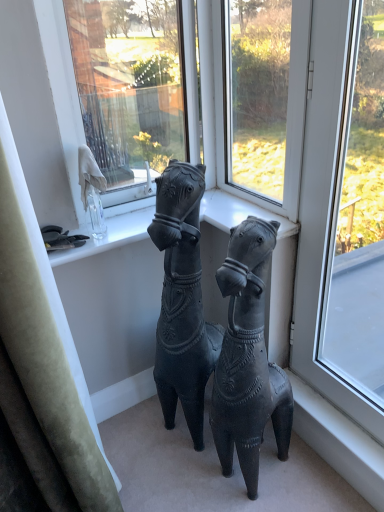
What is the approximate width of transparent glass window at center, placed as the second window when sorted from right to left?

It is 2.92 inches.

At what (x,y) coordinates should I click in order to perform the action: click on transparent glass window at center, placed as the second window when sorted from right to left. Please return your answer as a coordinate pair (x, y). The image size is (384, 512). Looking at the image, I should click on (258, 93).

What do you see at coordinates (44, 353) in the screenshot? I see `velvet green curtain at left` at bounding box center [44, 353].

You are a GUI agent. You are given a task and a screenshot of the screen. Output one action in this format:
    pyautogui.click(x=<x>, y=<y>)
    Task: Click on the transparent glass window screen at upper center
    The image size is (384, 512).
    Given the screenshot: What is the action you would take?
    pyautogui.click(x=130, y=84)

Identify the location of matte black horse at center, the 1th horse from the right. (248, 358).

You are a GUI agent. You are given a task and a screenshot of the screen. Output one action in this format:
    pyautogui.click(x=<x>, y=<y>)
    Task: Click on the matte black horse at center, acting as the 2th horse starting from the right
    
    Given the screenshot: What is the action you would take?
    pyautogui.click(x=182, y=300)

Choose the correct answer: Is matte black horse at center, positioned as the 2th horse in left-to-right order, inside matte black horse at center, acting as the 2th horse starting from the right, or outside it?

matte black horse at center, positioned as the 2th horse in left-to-right order, exists outside the volume of matte black horse at center, acting as the 2th horse starting from the right.

How many degrees apart are the facing directions of matte black horse at center, positioned as the 2th horse in left-to-right order, and matte black horse at center, acting as the 2th horse starting from the right?

There is a 0.000943-degree angle between the facing directions of matte black horse at center, positioned as the 2th horse in left-to-right order, and matte black horse at center, acting as the 2th horse starting from the right.

Is matte black horse at center, positioned as the 2th horse in left-to-right order, to the right of matte black horse at center, acting as the 2th horse starting from the right, from the viewer's perspective?

Yes, matte black horse at center, positioned as the 2th horse in left-to-right order, is to the right of matte black horse at center, acting as the 2th horse starting from the right.

Which is further, (236, 364) or (304, 133)?

The point (304, 133) is behind.

Is matte black horse at center, the 1th horse from the right, to the left of transparent glass window at right, which is counted as the first window, starting from the right, from the viewer's perspective?

Correct, you'll find matte black horse at center, the 1th horse from the right, to the left of transparent glass window at right, which is counted as the first window, starting from the right.

Does matte black horse at center, the 1th horse from the right, have a larger size compared to transparent glass window at right, which is counted as the first window, starting from the right?

Yes.

Is matte black horse at center, positioned as the 2th horse in left-to-right order, facing towards transparent glass window at right, which is counted as the first window, starting from the right?

No, matte black horse at center, positioned as the 2th horse in left-to-right order, is not turned towards transparent glass window at right, which is counted as the first window, starting from the right.

Considering the sizes of matte black horse at center, acting as the 2th horse starting from the right, and transparent glass window at center, placed as the second window when sorted from right to left, in the image, is matte black horse at center, acting as the 2th horse starting from the right, wider or thinner than transparent glass window at center, placed as the second window when sorted from right to left,?

Considering their sizes, matte black horse at center, acting as the 2th horse starting from the right, looks broader than transparent glass window at center, placed as the second window when sorted from right to left.

From a real-world perspective, is matte black horse at center, which is the 1th horse from left to right, positioned above or below transparent glass window at center, placed as the second window when sorted from right to left?

From a real-world perspective, matte black horse at center, which is the 1th horse from left to right, is physically below transparent glass window at center, placed as the second window when sorted from right to left.

Can you confirm if matte black horse at center, acting as the 2th horse starting from the right, is positioned to the left of transparent glass window at center, marked as the 1th window in a left-to-right arrangement?

Indeed, matte black horse at center, acting as the 2th horse starting from the right, is positioned on the left side of transparent glass window at center, marked as the 1th window in a left-to-right arrangement.

From the image's perspective, which object appears higher, matte black horse at center, acting as the 2th horse starting from the right, or transparent glass window at center, marked as the 1th window in a left-to-right arrangement?

transparent glass window at center, marked as the 1th window in a left-to-right arrangement, is shown above in the image.

Which is in front, point (257, 102) or point (231, 270)?

The point (231, 270) is closer to the camera.

Looking at this image, is transparent glass window at center, marked as the 1th window in a left-to-right arrangement, facing towards matte black horse at center, positioned as the 2th horse in left-to-right order?

No, transparent glass window at center, marked as the 1th window in a left-to-right arrangement, is not aimed at matte black horse at center, positioned as the 2th horse in left-to-right order.

From a real-world perspective, which is physically above, transparent glass window at center, placed as the second window when sorted from right to left, or matte black horse at center, positioned as the 2th horse in left-to-right order?

transparent glass window at center, placed as the second window when sorted from right to left, from a real-world perspective.

Which object is wider, transparent glass window at center, marked as the 1th window in a left-to-right arrangement, or matte black horse at center, the 1th horse from the right?

Wider between the two is matte black horse at center, the 1th horse from the right.

Between transparent glass window at right, which is counted as the first window, starting from the right, and velvet green curtain at left, which one is positioned behind?

transparent glass window at right, which is counted as the first window, starting from the right, is further away from the camera.

Looking at this image, who is bigger, transparent glass window at right, which is counted as the first window, starting from the right, or velvet green curtain at left?

Bigger between the two is velvet green curtain at left.

Considering the sizes of objects transparent glass window at right, which is counted as the first window, starting from the right, and velvet green curtain at left in the image provided, who is thinner, transparent glass window at right, which is counted as the first window, starting from the right, or velvet green curtain at left?

transparent glass window at right, which is counted as the first window, starting from the right.

Is transparent glass window at right, which is the second window from left to right, taller than velvet green curtain at left?

No.

From a real-world perspective, is transparent glass window screen at upper center located beneath matte black horse at center, positioned as the 2th horse in left-to-right order?

Actually, transparent glass window screen at upper center is physically above matte black horse at center, positioned as the 2th horse in left-to-right order, in the real world.

Is point (124, 115) closer to viewer compared to point (256, 220)?

No, it is behind (256, 220).

Looking at this image, is transparent glass window screen at upper center looking in the opposite direction of matte black horse at center, positioned as the 2th horse in left-to-right order?

That's not correct — transparent glass window screen at upper center is not looking away from matte black horse at center, positioned as the 2th horse in left-to-right order.

From a real-world perspective, which is physically above, matte black horse at center, positioned as the 2th horse in left-to-right order, or transparent glass window screen at upper center?

transparent glass window screen at upper center.

From the picture: Can you confirm if matte black horse at center, the 1th horse from the right, is thinner than transparent glass window screen at upper center?

In fact, matte black horse at center, the 1th horse from the right, might be wider than transparent glass window screen at upper center.

Which is in front, point (223, 418) or point (145, 34)?

Positioned in front is point (223, 418).

At what (x,y) coordinates should I click in order to perform the action: click on horse lying above the matte black horse at center, positioned as the 2th horse in left-to-right order (from the image's perspective). Please return your answer as a coordinate pair (x, y). Image resolution: width=384 pixels, height=512 pixels. Looking at the image, I should click on (182, 300).

Locate an element on the screen. Image resolution: width=384 pixels, height=512 pixels. horse that is the 2nd object located below the transparent glass window at right, which is counted as the first window, starting from the right (from the image's perspective) is located at coordinates (248, 358).

When comparing their distances from transparent glass window at right, which is counted as the first window, starting from the right, does transparent glass window screen at upper center or transparent glass window at center, placed as the second window when sorted from right to left, seem closer?

transparent glass window at center, placed as the second window when sorted from right to left.

Which object lies further to the anchor point transparent glass window screen at upper center, matte black horse at center, acting as the 2th horse starting from the right, or velvet green curtain at left?

Based on the image, velvet green curtain at left appears to be further to transparent glass window screen at upper center.

In the scene shown: Which object lies further to the anchor point transparent glass window at right, which is the second window from left to right, transparent glass window screen at upper center or matte black horse at center, the 1th horse from the right?

transparent glass window screen at upper center lies further to transparent glass window at right, which is the second window from left to right, than the other object.

When comparing their distances from matte black horse at center, the 1th horse from the right, does transparent glass window screen at upper center or matte black horse at center, acting as the 2th horse starting from the right, seem further?

transparent glass window screen at upper center lies further to matte black horse at center, the 1th horse from the right, than the other object.

Based on their spatial positions, is matte black horse at center, the 1th horse from the right, or velvet green curtain at left closer to matte black horse at center, which is the 1th horse from left to right?

Based on the image, matte black horse at center, the 1th horse from the right, appears to be nearer to matte black horse at center, which is the 1th horse from left to right.

Which object lies further to the anchor point transparent glass window screen at upper center, matte black horse at center, the 1th horse from the right, or transparent glass window at center, placed as the second window when sorted from right to left?

Based on the image, matte black horse at center, the 1th horse from the right, appears to be further to transparent glass window screen at upper center.

Estimate the real-world distances between objects in this image. Which object is closer to transparent glass window screen at upper center, transparent glass window at center, placed as the second window when sorted from right to left, or velvet green curtain at left?

transparent glass window at center, placed as the second window when sorted from right to left, lies closer to transparent glass window screen at upper center than the other object.

Based on their spatial positions, is transparent glass window at right, which is counted as the first window, starting from the right, or transparent glass window at center, placed as the second window when sorted from right to left, further from transparent glass window screen at upper center?

transparent glass window at right, which is counted as the first window, starting from the right, lies further to transparent glass window screen at upper center than the other object.

At what (x,y) coordinates should I click in order to perform the action: click on horse located between velvet green curtain at left and matte black horse at center, the 1th horse from the right, in the left-right direction. Please return your answer as a coordinate pair (x, y). This screenshot has width=384, height=512. Looking at the image, I should click on (182, 300).

Locate an element on the screen. Image resolution: width=384 pixels, height=512 pixels. window screen between transparent glass window at center, placed as the second window when sorted from right to left, and matte black horse at center, which is the 1th horse from left to right, in the vertical direction is located at coordinates (130, 84).

The image size is (384, 512). I want to click on window that lies between transparent glass window at center, placed as the second window when sorted from right to left, and matte black horse at center, the 1th horse from the right, from top to bottom, so click(x=323, y=209).

The height and width of the screenshot is (512, 384). I want to click on curtain between transparent glass window at center, placed as the second window when sorted from right to left, and matte black horse at center, the 1th horse from the right, from top to bottom, so click(44, 353).